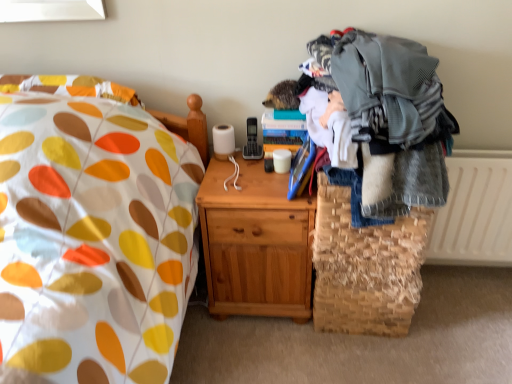
Where is `free spot above light brown wood nightstand at center (from a real-world perspective)`? This screenshot has height=384, width=512. free spot above light brown wood nightstand at center (from a real-world perspective) is located at coordinates (249, 180).